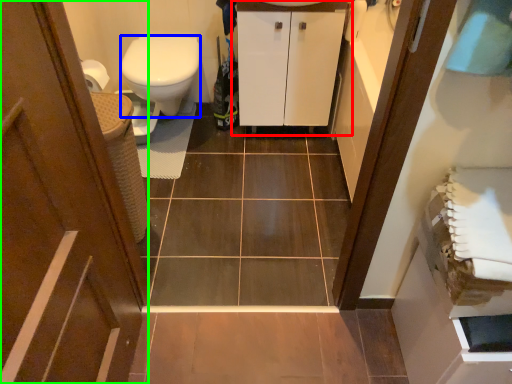
Question: Considering the real-world distances, which object is closest to bathroom cabinet (highlighted by a red box)? bidet (highlighted by a blue box) or door (highlighted by a green box).

Choices:
 (A) bidet
 (B) door

Answer: (A)